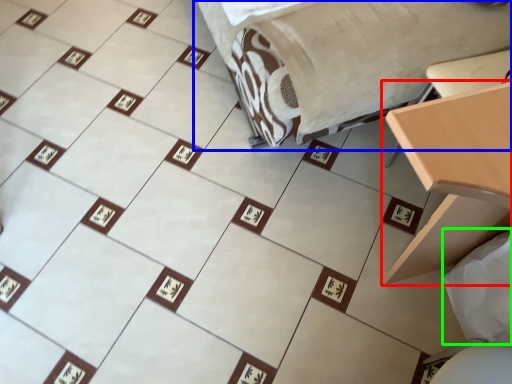
Question: Considering the real-world distances, which object is closest to table (highlighted by a red box)? furniture (highlighted by a blue box) or sheet (highlighted by a green box).

Choices:
 (A) furniture
 (B) sheet

Answer: (B)